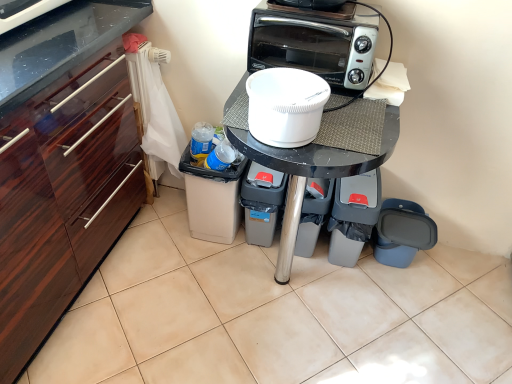
Locate an element on the screen. This screenshot has height=384, width=512. free spot to the left of black glossy table at center is located at coordinates (158, 281).